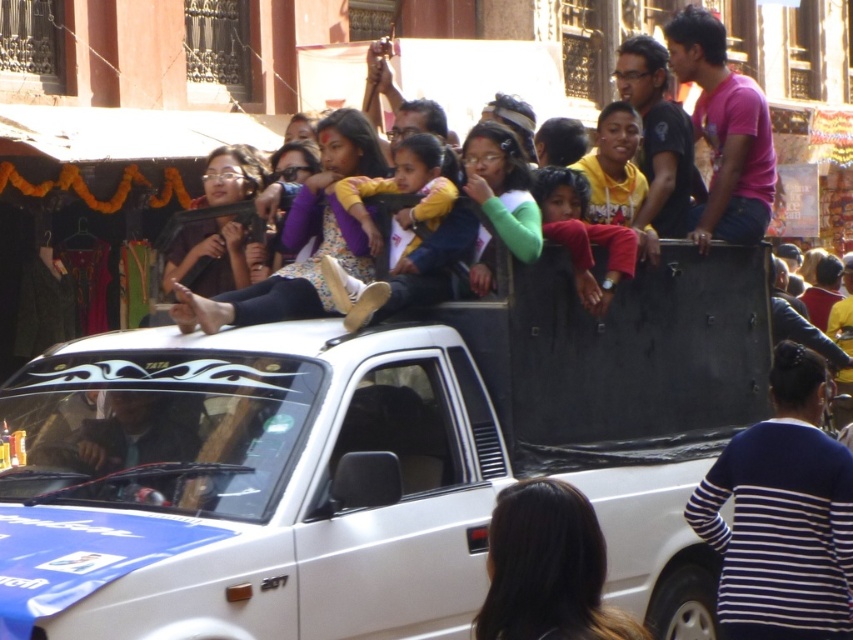
Does white matte truck at center have a greater height compared to pink matte shirt at upper right?

No, white matte truck at center is not taller than pink matte shirt at upper right.

Can you confirm if white matte truck at center is positioned to the left of pink matte shirt at upper right?

Yes, white matte truck at center is to the left of pink matte shirt at upper right.

Identify the location of white matte truck at center. (373, 458).

At what (x,y) coordinates should I click in order to perform the action: click on white matte truck at center. Please return your answer as a coordinate pair (x, y). The height and width of the screenshot is (640, 853). Looking at the image, I should click on (373, 458).

Which of these two, black matte truck at center or red fabric child at center, stands shorter?

red fabric child at center is shorter.

Can you confirm if black matte truck at center is positioned to the right of red fabric child at center?

Yes, black matte truck at center is to the right of red fabric child at center.

Who is more distant from viewer, (788, 381) or (543, 220)?

Positioned behind is point (543, 220).

The height and width of the screenshot is (640, 853). I want to click on black matte truck at center, so click(x=782, y=515).

Can you confirm if pink matte shirt at upper right is shorter than yellow fabric jacket at center?

No, pink matte shirt at upper right is not shorter than yellow fabric jacket at center.

Is point (726, 125) positioned behind point (440, 298)?

Yes, it is.

Where is `pink matte shirt at upper right`? This screenshot has width=853, height=640. pink matte shirt at upper right is located at coordinates (724, 131).